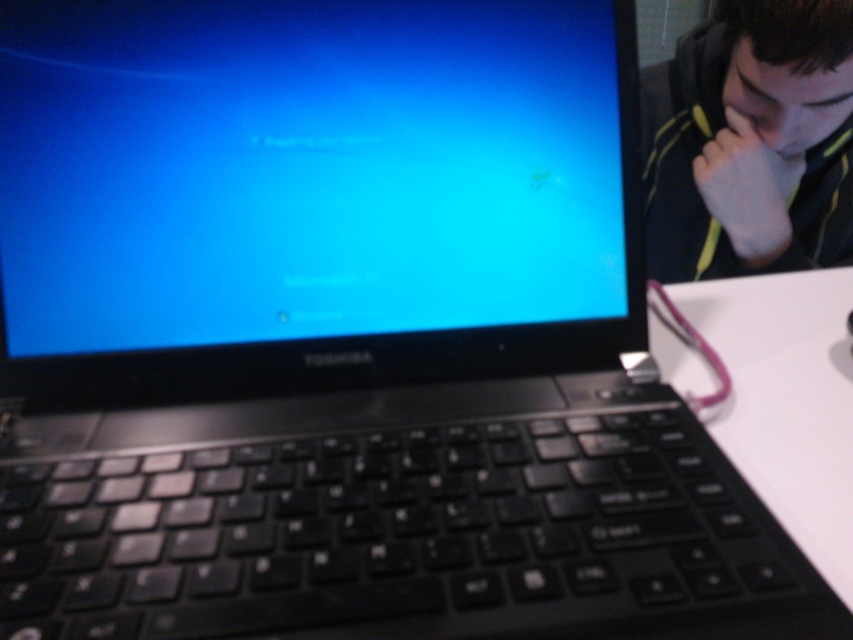
Question: Can you confirm if blue glossy screen at center is smaller than black fleece jacket at upper right?

Choices:
 (A) no
 (B) yes

Answer: (B)

Question: Does blue glossy screen at center come in front of white matte table at lower right?

Choices:
 (A) yes
 (B) no

Answer: (B)

Question: Which object is closer to the camera taking this photo?

Choices:
 (A) black fleece jacket at upper right
 (B) blue glossy screen at center

Answer: (B)

Question: Which of the following is the closest to the observer?

Choices:
 (A) (91, 211)
 (B) (755, 225)

Answer: (A)

Question: Which point is farther to the camera?

Choices:
 (A) (149, 129)
 (B) (846, 336)
 (C) (697, 259)

Answer: (C)

Question: Does black fleece jacket at upper right appear on the right side of white matte table at lower right?

Choices:
 (A) no
 (B) yes

Answer: (B)